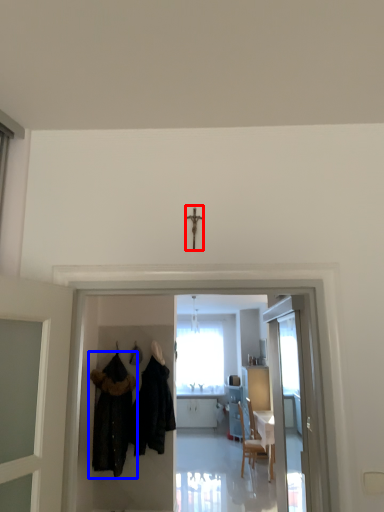
Question: Which of the following is the closest to the observer, crucifix (highlighted by a red box) or fancy dress (highlighted by a blue box)?

Choices:
 (A) crucifix
 (B) fancy dress

Answer: (A)